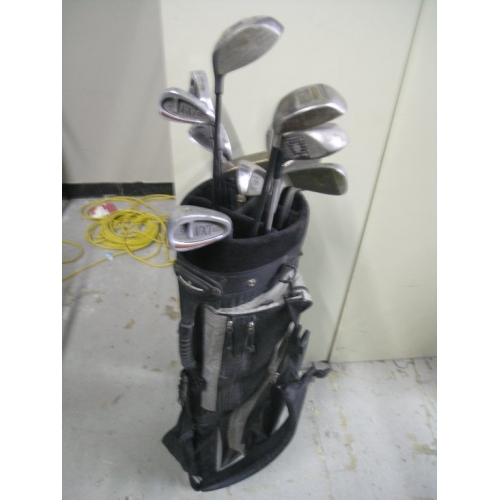
This screenshot has height=500, width=500. I want to click on cabinet, so click(x=380, y=223).